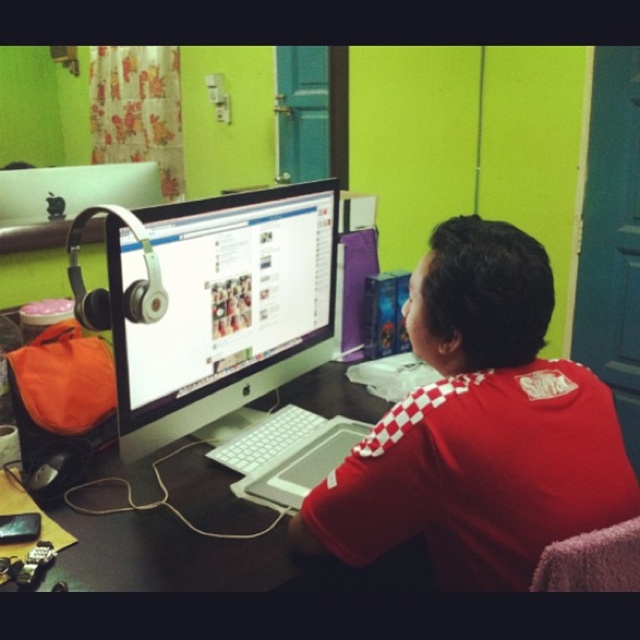
Is red checkered shirt at center shorter than black glossy table at center?

Incorrect, red checkered shirt at center's height does not fall short of black glossy table at center's.

Does red checkered shirt at center appear under black glossy table at center?

Actually, red checkered shirt at center is above black glossy table at center.

This screenshot has height=640, width=640. What do you see at coordinates (477, 428) in the screenshot? I see `red checkered shirt at center` at bounding box center [477, 428].

Locate an element on the screen. red checkered shirt at center is located at coordinates (477, 428).

Is black glossy table at center closer to camera compared to white plastic keyboard at center?

Yes.

Which is behind, point (202, 456) or point (289, 444)?

The point (289, 444) is more distant.

Locate an element on the screen. The width and height of the screenshot is (640, 640). black glossy table at center is located at coordinates (211, 557).

Is white glossy monitor at center closer to camera compared to black glossy table at center?

No, white glossy monitor at center is behind black glossy table at center.

This screenshot has width=640, height=640. In order to click on white glossy monitor at center in this screenshot , I will do `click(221, 307)`.

Image resolution: width=640 pixels, height=640 pixels. Describe the element at coordinates (221, 307) in the screenshot. I see `white glossy monitor at center` at that location.

This screenshot has height=640, width=640. What are the coordinates of `white glossy monitor at center` in the screenshot? It's located at (221, 307).